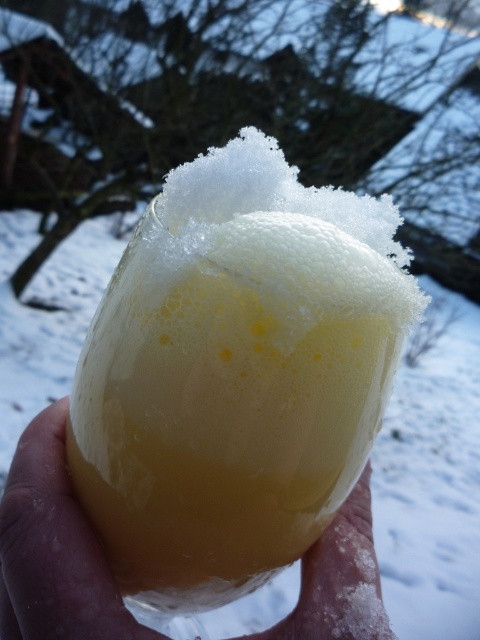
You are standing in a snowy winter scene holding a glass of beer. The camera is positioned at your eye level. There is a point marked at coordinates (146, 380). Can you estimate how far this point is from the camera in inches?

The point at coordinates (146, 380) is 8.66 inches away from the camera.

You are at a winter party and see two drink containers, the translucent glass at center and the translucent plastic cup at center. Which one is positioned more to the right?

The translucent glass at center is positioned more to the right than the translucent plastic cup at center.

From the picture: You are at a winter party and holding both the translucent glass at center and the translucent plastic cup at center. You want to pour a hot beverage into one of them. Which container should you choose to avoid it melting or breaking?

The translucent plastic cup at center should be chosen because the translucent glass at center is much taller and might break when holding hot liquids, while plastic is more heat resistant.